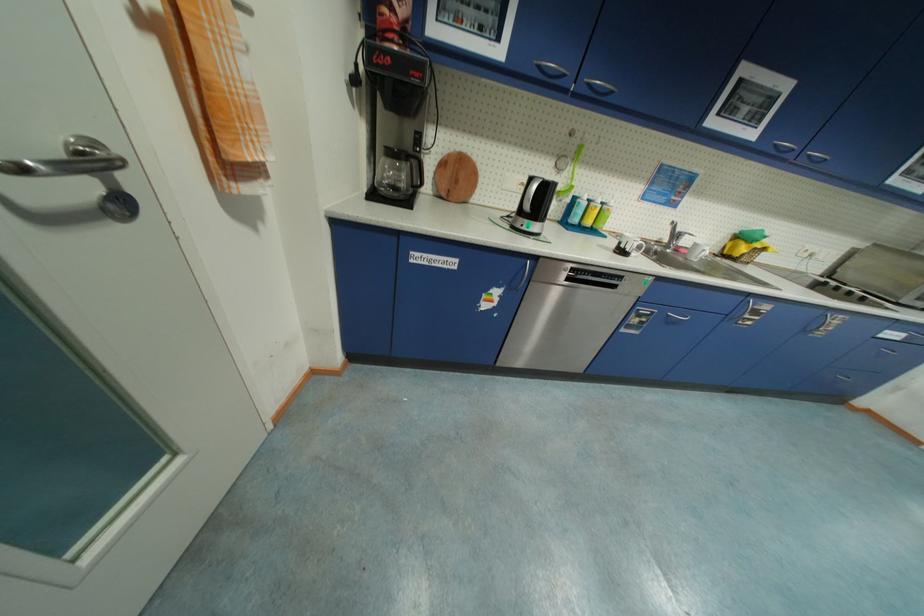
The width and height of the screenshot is (924, 616). What do you see at coordinates (417, 171) in the screenshot?
I see `a coffee pot handle` at bounding box center [417, 171].